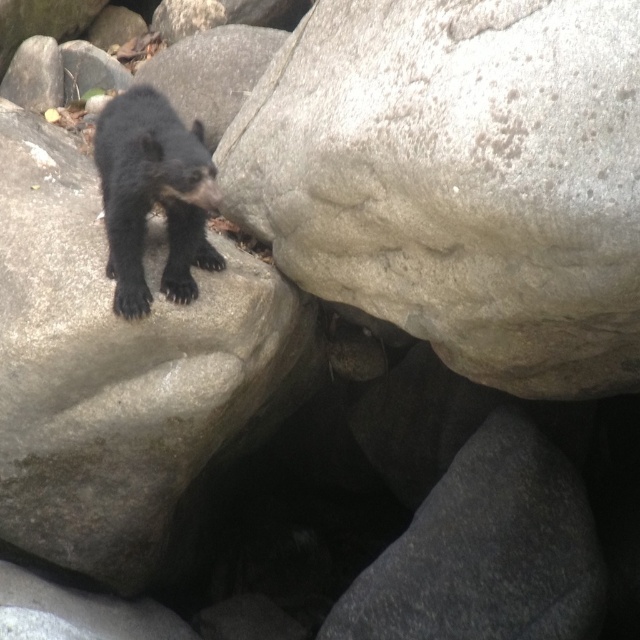
You are a hiker trying to locate the gray rough boulder at center in a rocky area. A GPS device shows a point at coordinates (x=458, y=179). Is this point likely marking the gray rough boulder at center?

Yes, the point at coordinates (x=458, y=179) marks the gray rough boulder at center according to the description.

You are a hiker who wants to place a 2.5 meters long tent between the gray rough boulder at center and another rock. Is there enough space?

The distance between the gray rough boulder at center and the other rock is 2.37 meters, which is shorter than the tent length of 2.5 meters. Therefore, the tent cannot fit between them.